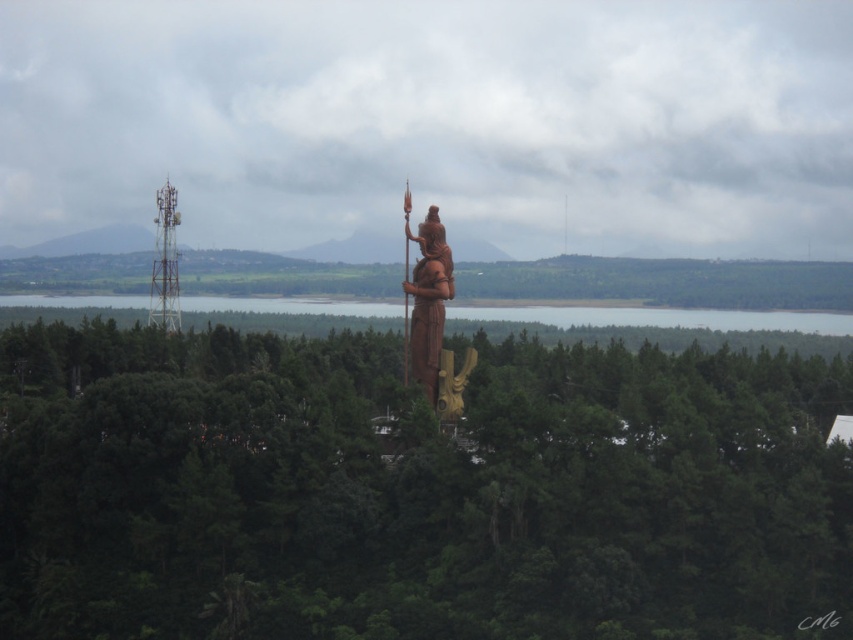
Consider the image. Who is more forward, (691, 312) or (405, 243)?

Point (405, 243) is in front.

Who is positioned more to the right, green water at center or wooden statue at center?

wooden statue at center is more to the right.

Describe the element at coordinates (659, 317) in the screenshot. I see `green water at center` at that location.

The width and height of the screenshot is (853, 640). Find the location of `green water at center`. green water at center is located at coordinates (659, 317).

Does point (769, 394) come farther from viewer compared to point (403, 381)?

No, (769, 394) is in front of (403, 381).

Between green matte tree at center and wooden statue at center, which one appears on the right side from the viewer's perspective?

From the viewer's perspective, green matte tree at center appears more on the right side.

You are a GUI agent. You are given a task and a screenshot of the screen. Output one action in this format:
    pyautogui.click(x=<x>, y=<y>)
    Task: Click on the green matte tree at center
    The height and width of the screenshot is (640, 853).
    Given the screenshot: What is the action you would take?
    pyautogui.click(x=415, y=490)

You are a GUI agent. You are given a task and a screenshot of the screen. Output one action in this format:
    pyautogui.click(x=<x>, y=<y>)
    Task: Click on the green matte tree at center
    This screenshot has width=853, height=640.
    Given the screenshot: What is the action you would take?
    pyautogui.click(x=415, y=490)

Does green matte tree at center have a lesser height compared to metallic tower at left?

Incorrect, green matte tree at center's height does not fall short of metallic tower at left's.

Who is taller, green matte tree at center or metallic tower at left?

green matte tree at center is taller.

Between point (112, 608) and point (175, 256), which one is positioned in front?

Point (112, 608)

The image size is (853, 640). Find the location of `green matte tree at center`. green matte tree at center is located at coordinates (415, 490).